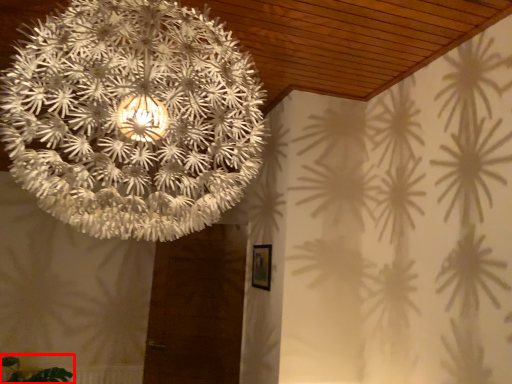
Question: From the image's perspective, what is the correct spatial positioning of plant (annotated by the red box) in reference to lamp?

Choices:
 (A) above
 (B) below

Answer: (B)